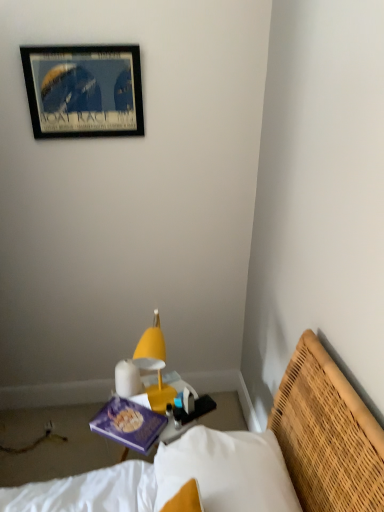
Question: Can you confirm if yellow woven bed at lower right is wider than wooden framed poster at upper left?

Choices:
 (A) no
 (B) yes

Answer: (B)

Question: From a real-world perspective, is yellow woven bed at lower right physically below wooden framed poster at upper left?

Choices:
 (A) yes
 (B) no

Answer: (A)

Question: Does yellow woven bed at lower right have a lesser width compared to wooden framed poster at upper left?

Choices:
 (A) no
 (B) yes

Answer: (A)

Question: Considering the relative sizes of yellow woven bed at lower right and wooden framed poster at upper left in the image provided, is yellow woven bed at lower right bigger than wooden framed poster at upper left?

Choices:
 (A) yes
 (B) no

Answer: (A)

Question: From the image's perspective, is yellow woven bed at lower right on wooden framed poster at upper left?

Choices:
 (A) no
 (B) yes

Answer: (A)

Question: Is wooden framed poster at upper left inside the boundaries of yellow plastic lamp at center, or outside?

Choices:
 (A) outside
 (B) inside

Answer: (A)

Question: From a real-world perspective, is wooden framed poster at upper left above or below yellow plastic lamp at center?

Choices:
 (A) below
 (B) above

Answer: (B)

Question: From the image's perspective, relative to yellow plastic lamp at center, is wooden framed poster at upper left above or below?

Choices:
 (A) below
 (B) above

Answer: (B)

Question: Considering the positions of wooden framed poster at upper left and yellow plastic lamp at center in the image, is wooden framed poster at upper left taller or shorter than yellow plastic lamp at center?

Choices:
 (A) short
 (B) tall

Answer: (A)

Question: From the image's perspective, relative to purple matte book at center, is yellow woven bed at lower right above or below?

Choices:
 (A) below
 (B) above

Answer: (A)

Question: Is point (62, 504) positioned closer to the camera than point (134, 441)?

Choices:
 (A) farther
 (B) closer

Answer: (B)

Question: From a real-world perspective, is yellow woven bed at lower right positioned above or below purple matte book at center?

Choices:
 (A) above
 (B) below

Answer: (A)

Question: Considering the relative positions of yellow woven bed at lower right and purple matte book at center in the image provided, is yellow woven bed at lower right to the left or to the right of purple matte book at center?

Choices:
 (A) left
 (B) right

Answer: (B)

Question: In the image, is wooden framed poster at upper left positioned in front of or behind purple matte book at center?

Choices:
 (A) behind
 (B) front

Answer: (A)

Question: Is point (49, 51) closer or farther from the camera than point (135, 442)?

Choices:
 (A) closer
 (B) farther

Answer: (B)